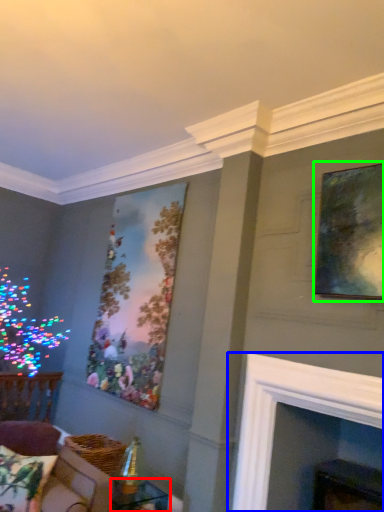
Question: Which object is positioned farthest from table (highlighted by a red box)? Select from fireplace (highlighted by a blue box) and picture frame (highlighted by a green box).

Choices:
 (A) fireplace
 (B) picture frame

Answer: (B)